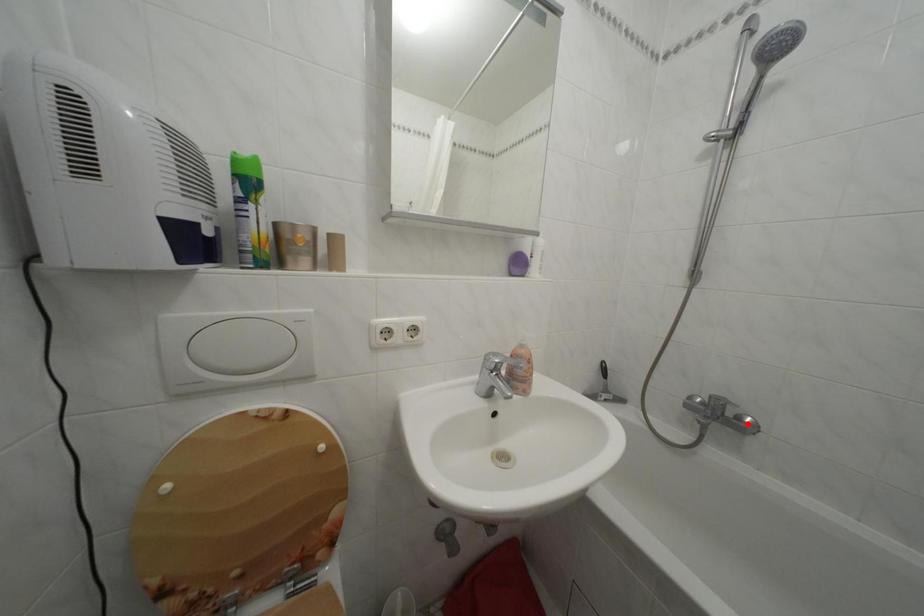
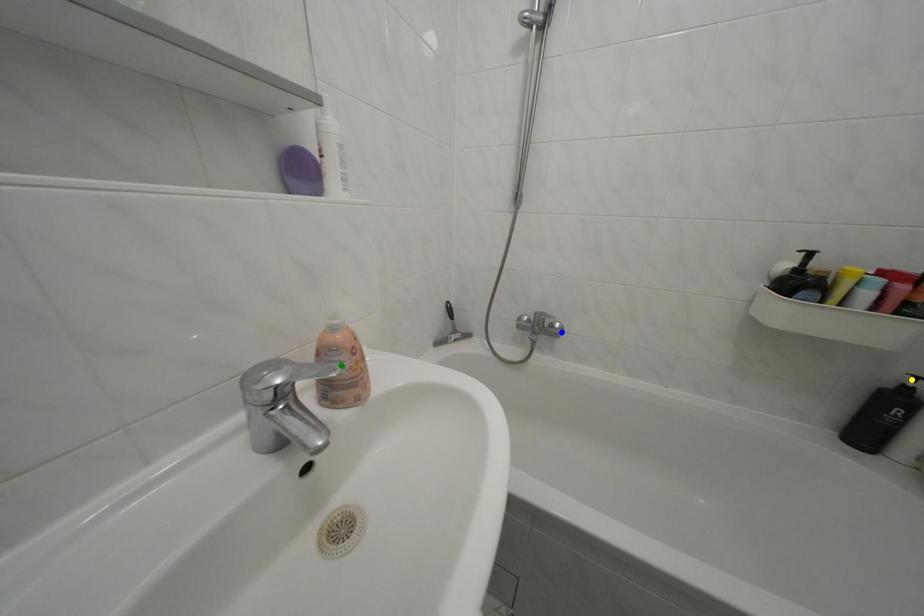
Question: I am providing you with two images of the same scene from different viewpoints. A red point is marked on the first image. You are given multiple points on the second image. Can you choose the point in image 2 that corresponds to the point in image 1?

Choices:
 (A) green point
 (B) blue point
 (C) yellow point

Answer: (B)